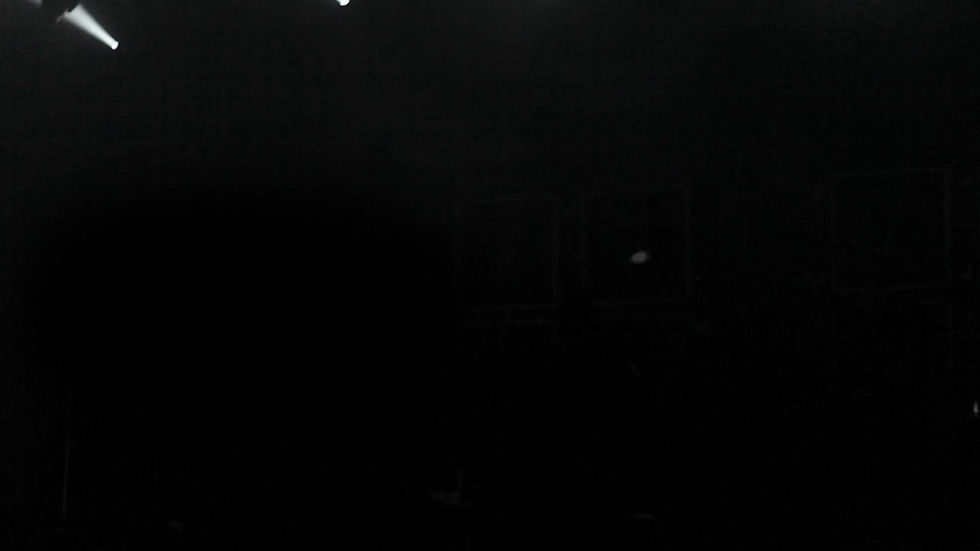
Where is `space under spotlight`? space under spotlight is located at coordinates (102, 73).